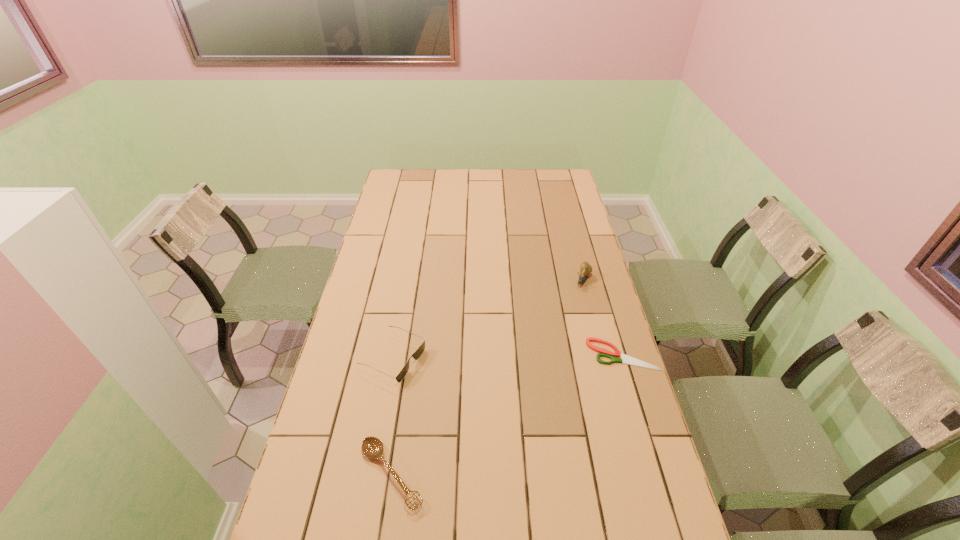
Identify the location of ladle. (372, 447).

The width and height of the screenshot is (960, 540). Identify the location of the nearest object. (372, 447).

The width and height of the screenshot is (960, 540). I want to click on the shortest object, so click(x=625, y=359).

At what (x,y) coordinates should I click in order to perform the action: click on the second tallest object. Please return your answer as a coordinate pair (x, y). The height and width of the screenshot is (540, 960). Looking at the image, I should click on (416, 355).

Where is `escargot`? This screenshot has height=540, width=960. escargot is located at coordinates point(585,268).

Find the location of a particular element. The height and width of the screenshot is (540, 960). the farthest object is located at coordinates (585, 268).

Locate an element on the screen. vacant space located on the back of the nearest object is located at coordinates (407, 372).

This screenshot has width=960, height=540. What are the coordinates of `vacant region located 0.220m on the front of the shortest object` in the screenshot? It's located at point(648,438).

Locate an element on the screen. Image resolution: width=960 pixels, height=540 pixels. free location located 0.210m on the front-facing side of the second tallest object is located at coordinates (481, 397).

Locate an element on the screen. free space located on the front-facing side of the second tallest object is located at coordinates (496, 404).